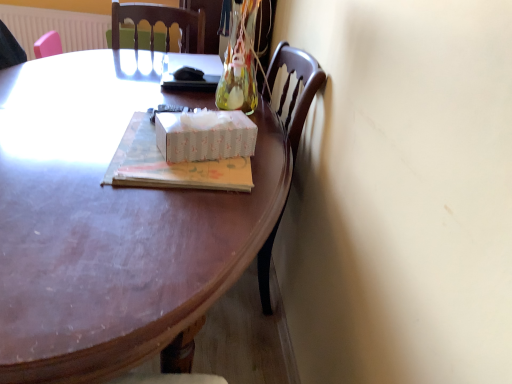
Where is `free space that is to the left of matte cardboard book at center`? The width and height of the screenshot is (512, 384). free space that is to the left of matte cardboard book at center is located at coordinates (71, 127).